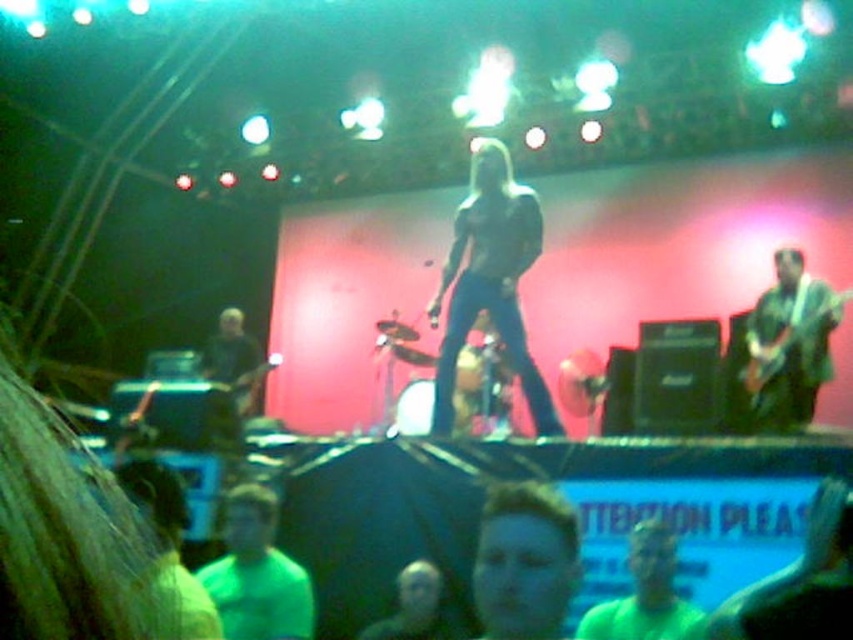
Does shiny black guitar at center have a lesser height compared to shiny green guitar at right?

No, shiny black guitar at center is not shorter than shiny green guitar at right.

Does shiny black guitar at center have a greater width compared to shiny green guitar at right?

Yes, shiny black guitar at center is wider than shiny green guitar at right.

You are a GUI agent. You are given a task and a screenshot of the screen. Output one action in this format:
    pyautogui.click(x=<x>, y=<y>)
    Task: Click on the shiny black guitar at center
    This screenshot has height=640, width=853.
    Given the screenshot: What is the action you would take?
    pyautogui.click(x=490, y=282)